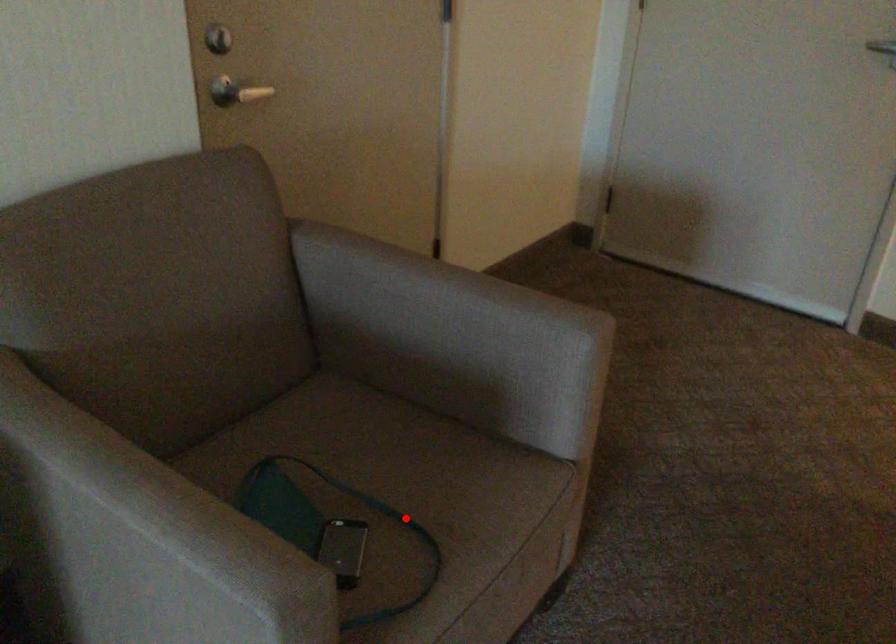
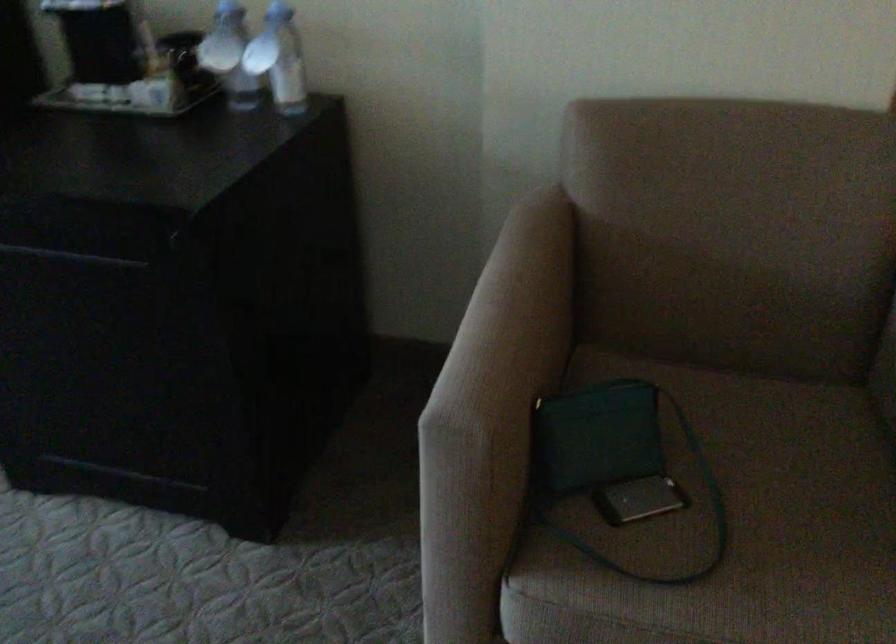
Locate, in the second image, the point that corresponds to the highlighted location in the first image.

(729, 526)